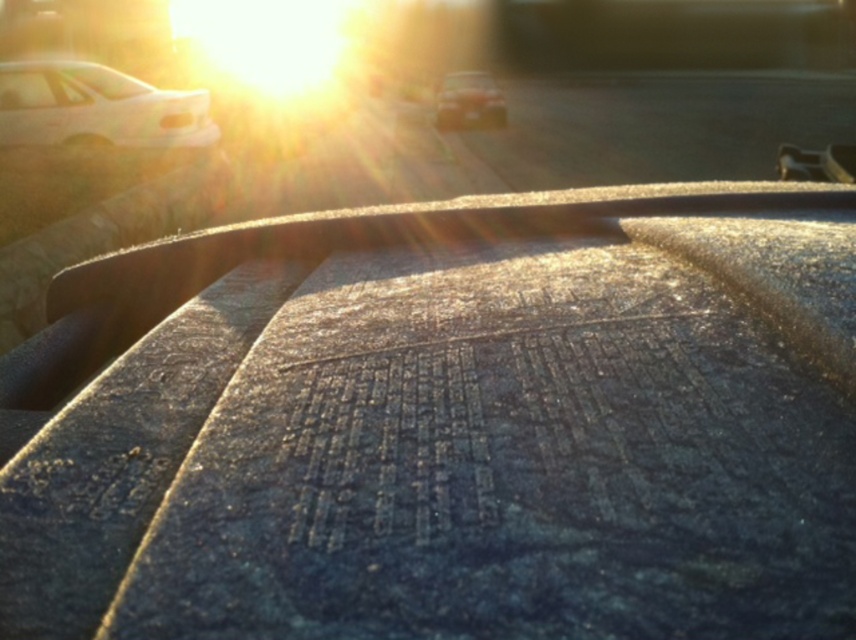
You are a passenger in the vehicle and looking at the dashboard. You see the white matte car at left and the metallic silver car at center through the windshield. Which car is closer to the dashboard?

The white matte car at left is closer to the dashboard because it is located below the metallic silver car at center, indicating it is positioned in front of the vehicle you are in.

You are driving and looking at the dashboard. There is a point marked at coordinates (94, 116) on the windshield. What object does this point correspond to?

The point at coordinates (94, 116) marks the white matte car at left.

You are driving a car and looking through the windshield. You see a white matte car at left and a metallic silver car at center. Which car appears smaller in the view?

The white matte car at left appears smaller compared to the metallic silver car at center because it is closer in size but according to the description, it has a smaller size.